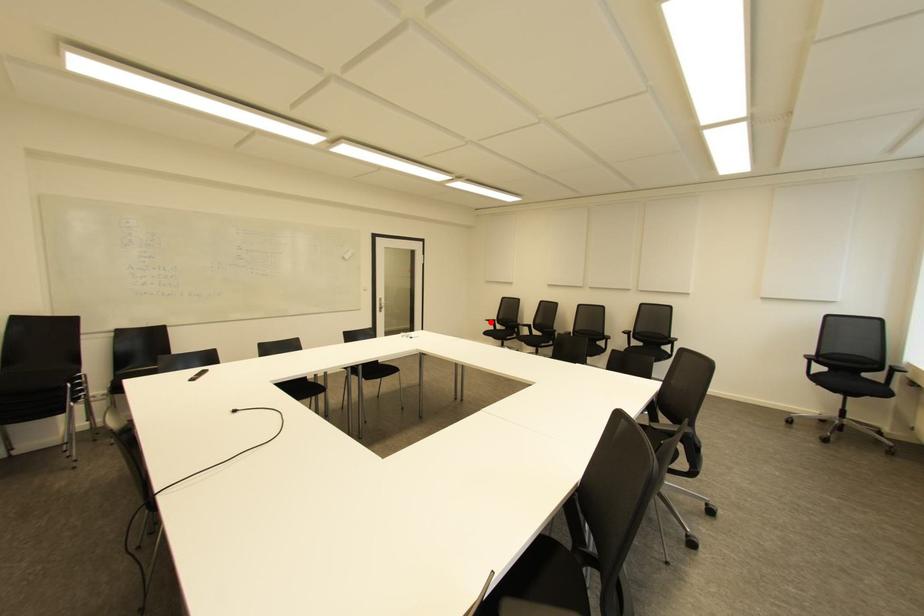
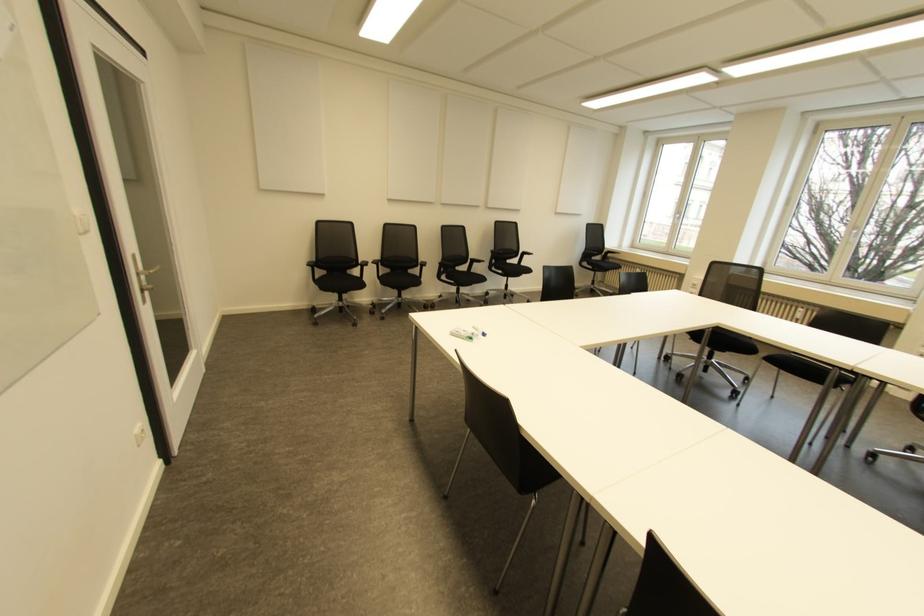
The point at the highlighted location is marked in the first image. Where is the corresponding point in the second image?

(310, 268)